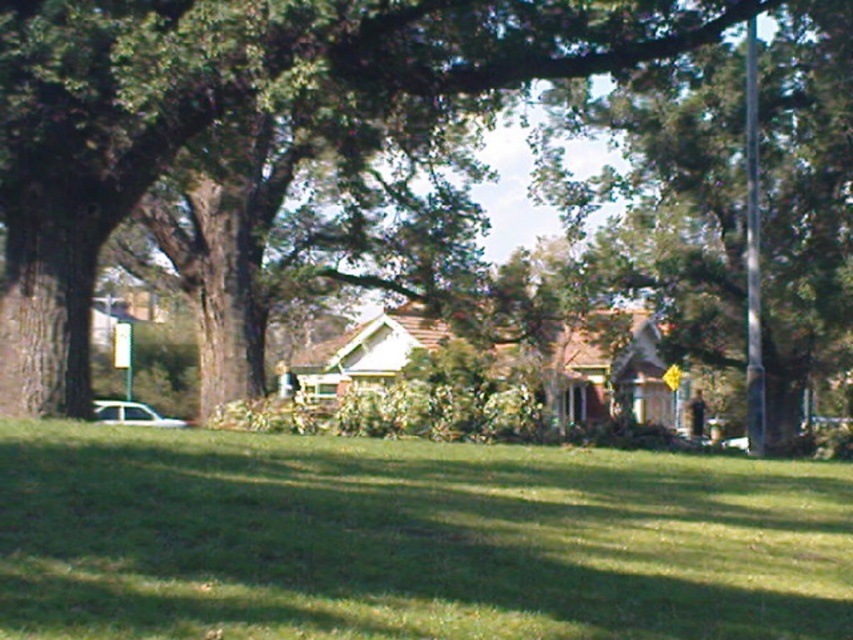
You are standing in the suburban scene and want to know which object is taller between the green grass at lower center and the green leafy tree at center. Can you determine which one is taller?

The green leafy tree at center is taller than the green grass at lower center.

You are standing in the suburban scene and want to walk from the green leafy tree at center to the green grass at lower center. Which direction should you move relative to the tree?

The green grass at lower center is positioned on the right side of the green leafy tree at center, so you should move to the right relative to the tree to reach it.

Looking at this image, you are standing at the center of the image and want to walk to the green grass at lower center. Which direction should you move to reach it?

The green grass at lower center is located at point coordinates of 0.844 on the x axis and 0.482 on the y axis. Since you are at the center of the image, you should move towards the lower right direction to reach it.